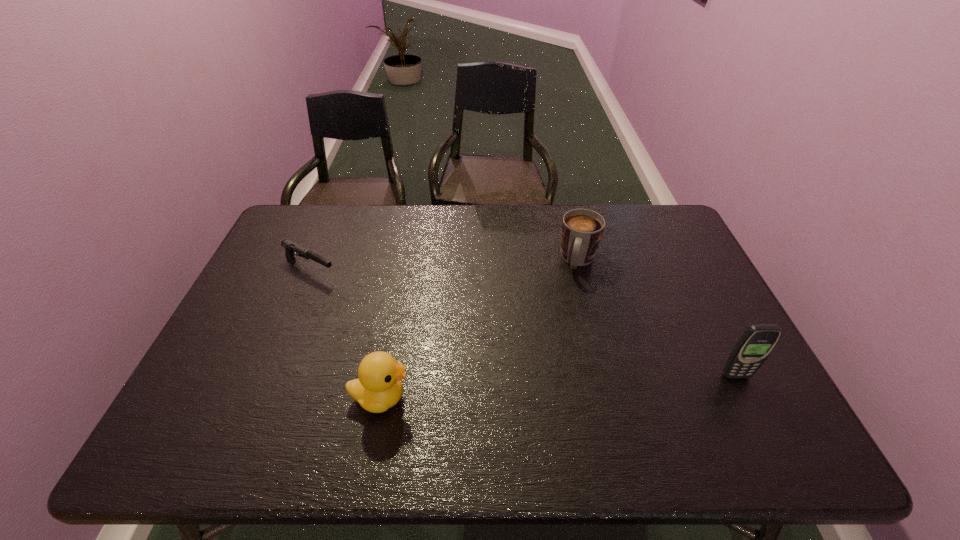
Where is `the third object from right to left`? This screenshot has width=960, height=540. the third object from right to left is located at coordinates (379, 387).

You are a GUI agent. You are given a task and a screenshot of the screen. Output one action in this format:
    pyautogui.click(x=<x>, y=<y>)
    Task: Click on the rightmost object
    The width and height of the screenshot is (960, 540).
    Given the screenshot: What is the action you would take?
    pyautogui.click(x=755, y=345)

You are a GUI agent. You are given a task and a screenshot of the screen. Output one action in this format:
    pyautogui.click(x=<x>, y=<y>)
    Task: Click on the tallest object
    
    Given the screenshot: What is the action you would take?
    pyautogui.click(x=755, y=345)

Locate an element on the screen. The width and height of the screenshot is (960, 540). mug is located at coordinates (582, 229).

Where is `the shortest object`? This screenshot has height=540, width=960. the shortest object is located at coordinates (290, 247).

This screenshot has width=960, height=540. Find the location of `gun`. gun is located at coordinates (290, 247).

Find the location of a particular element. free spot located on the face of the third object from right to left is located at coordinates (565, 397).

Where is `vacant area situated 0.060m on the screen of the rightmost object`? This screenshot has width=960, height=540. vacant area situated 0.060m on the screen of the rightmost object is located at coordinates (749, 401).

Where is `free space located on the side of the mug with the handle`? The image size is (960, 540). free space located on the side of the mug with the handle is located at coordinates (572, 294).

You are a GUI agent. You are given a task and a screenshot of the screen. Output one action in this format:
    pyautogui.click(x=<x>, y=<y>)
    Task: Click on the free space located on the side of the mug with the handle
    
    Given the screenshot: What is the action you would take?
    pyautogui.click(x=573, y=292)